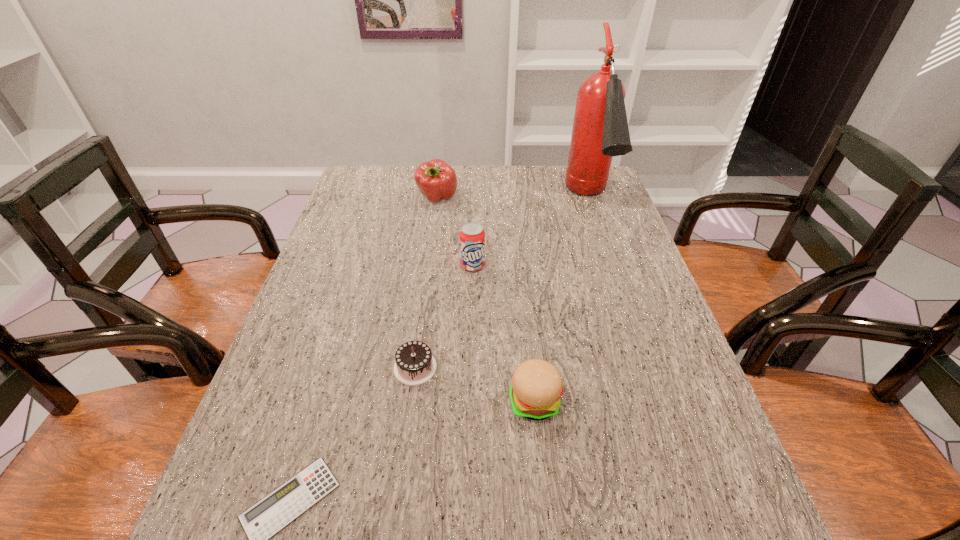
You are a GUI agent. You are given a task and a screenshot of the screen. Output one action in this format:
    pyautogui.click(x=<x>, y=<y>)
    Task: Click on the free space at the right edge of the desktop
    This screenshot has height=540, width=960.
    Given the screenshot: What is the action you would take?
    pyautogui.click(x=655, y=332)

In the image, there is a desktop. At what (x,y) coordinates should I click in order to perform the action: click on vacant area at the near right corner. Please return your answer as a coordinate pair (x, y). The height and width of the screenshot is (540, 960). Looking at the image, I should click on (752, 521).

Locate an element on the screen. unoccupied position between the second shortest object and the pepper is located at coordinates (426, 283).

Where is `blank region between the fourth tallest object and the rightmost object`? This screenshot has width=960, height=540. blank region between the fourth tallest object and the rightmost object is located at coordinates pyautogui.click(x=563, y=301).

Locate an element on the screen. Image resolution: width=960 pixels, height=540 pixels. free space between the rightmost object and the third farthest object is located at coordinates [x=531, y=233].

This screenshot has width=960, height=540. In order to click on empty space that is in between the fifth object from left to right and the fifth tallest object in this screenshot , I will do `click(475, 384)`.

Locate an element on the screen. free space between the rightmost object and the hamburger is located at coordinates (563, 301).

Find the location of a particular element. The height and width of the screenshot is (540, 960). free space between the pepper and the third shortest object is located at coordinates (486, 300).

You are a GUI agent. You are given a task and a screenshot of the screen. Output one action in this format:
    pyautogui.click(x=<x>, y=<y>)
    Task: Click on the object that is the fifth closest one to the third object from right to left
    The image size is (960, 540).
    Given the screenshot: What is the action you would take?
    pyautogui.click(x=263, y=520)

Locate an element on the screen. This screenshot has width=960, height=540. object that is the fourth closest to the shortest object is located at coordinates (435, 179).